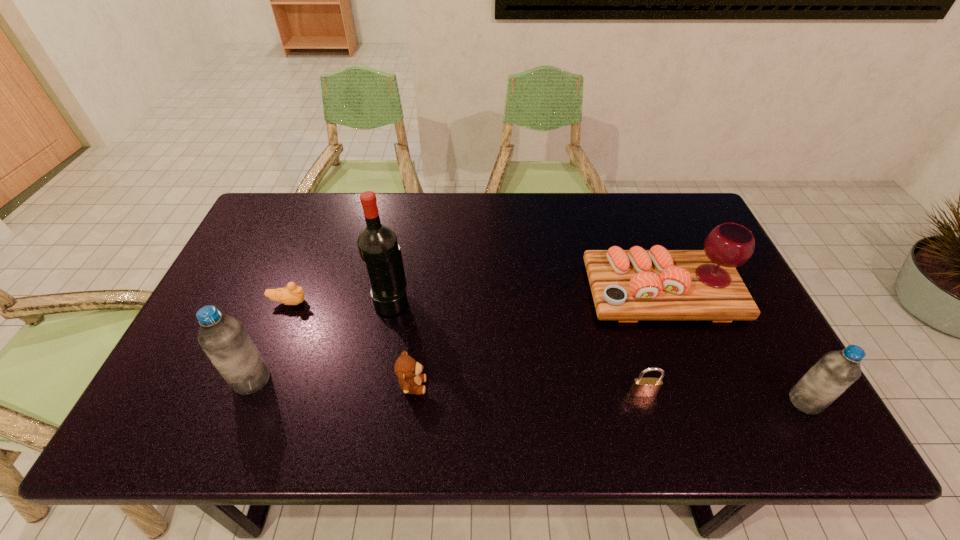
Locate which object is the sixth closest to the platter. Please provide its 2D coordinates. Your answer should be formatted as a tuple, i.e. [(x, y)], where the tuple contains the x and y coordinates of a point satisfying the conditions above.

[(223, 338)]

Find the location of `object that is the third nearest to the padlock`. object that is the third nearest to the padlock is located at coordinates (407, 369).